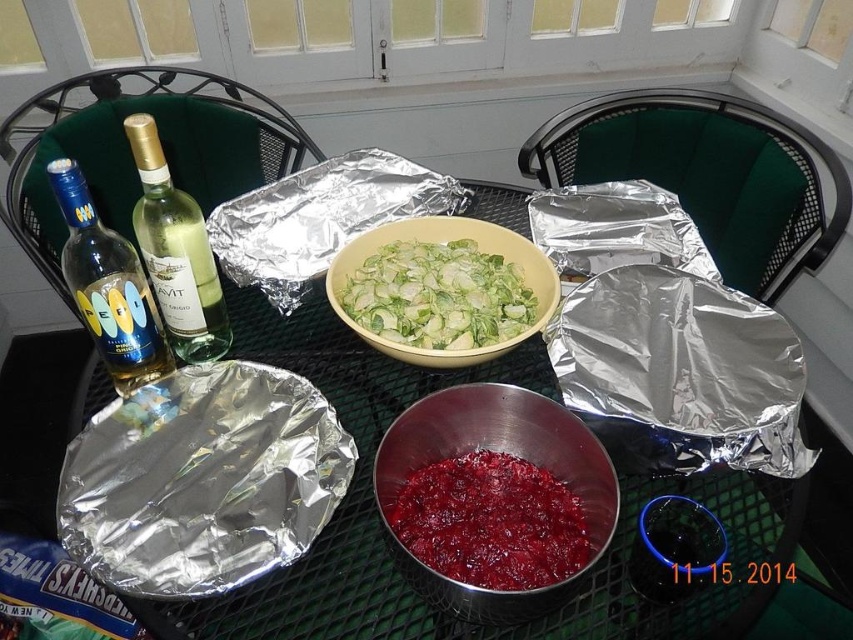
Where is `metallic foil at center`? This screenshot has width=853, height=640. metallic foil at center is located at coordinates (387, 541).

Which is more to the right, metallic foil at center or yellow matte bowl at center?

Positioned to the right is yellow matte bowl at center.

Image resolution: width=853 pixels, height=640 pixels. In order to click on metallic foil at center in this screenshot , I will do `click(387, 541)`.

Can you confirm if shiny metallic cranberry sauce at center is positioned to the right of matte glass bottle at left?

Yes, shiny metallic cranberry sauce at center is to the right of matte glass bottle at left.

Who is taller, shiny metallic cranberry sauce at center or matte glass bottle at left?

With more height is matte glass bottle at left.

Where is `shiny metallic cranberry sauce at center`? This screenshot has height=640, width=853. shiny metallic cranberry sauce at center is located at coordinates (490, 522).

Is silver reflective foil at lower left to the right of shiny metallic cranberry sauce at center from the viewer's perspective?

In fact, silver reflective foil at lower left is to the left of shiny metallic cranberry sauce at center.

Identify the location of silver reflective foil at lower left. (202, 481).